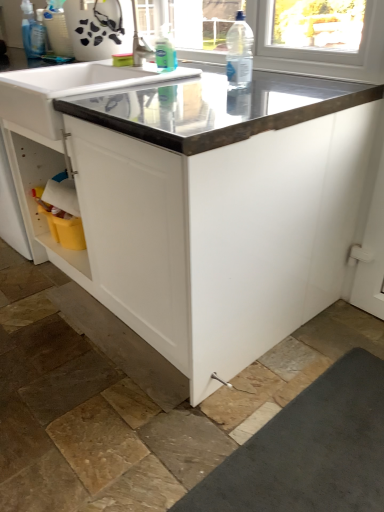
Question: From the image's perspective, is white glossy sink at upper center located above or below clear plastic bottle at upper center?

Choices:
 (A) below
 (B) above

Answer: (A)

Question: Considering the positions of point (67, 79) and point (248, 53), is point (67, 79) closer or farther from the camera than point (248, 53)?

Choices:
 (A) closer
 (B) farther

Answer: (A)

Question: Estimate the real-world distances between objects in this image. Which object is farther from the white glossy sink at upper center?

Choices:
 (A) metallic gray countertop at center
 (B) clear plastic bottle at upper center
 (C) translucent plastic spray bottle at upper left, the second cleaning product in the front-to-back sequence
 (D) translucent plastic bottle at upper center, which is counted as the second cleaning product, starting from the top

Answer: (C)

Question: Considering the real-world distances, which object is closest to the metallic gray countertop at center?

Choices:
 (A) clear plastic bottle at upper center
 (B) translucent plastic bottle at upper center, the 2th cleaning product in the back-to-front sequence
 (C) translucent plastic spray bottle at upper left, arranged as the second cleaning product when ordered from the bottom
 (D) white glossy sink at upper center

Answer: (D)